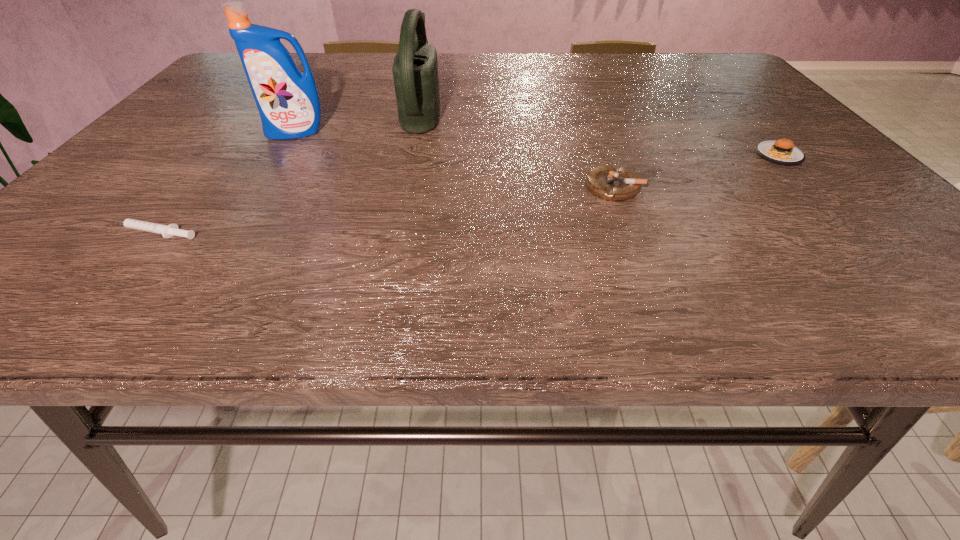
Locate an element on the screen. empty space between the food and the detergent is located at coordinates (538, 144).

At what (x,y) coordinates should I click in order to perform the action: click on unoccupied area between the nearest object and the food. Please return your answer as a coordinate pair (x, y). This screenshot has height=540, width=960. Looking at the image, I should click on (465, 194).

Identify the location of vacant space that's between the food and the third object from left to right. (601, 132).

Locate an element on the screen. This screenshot has height=540, width=960. unoccupied area between the second tallest object and the syringe is located at coordinates (286, 171).

What are the coordinates of `unoccupied position between the third object from left to right and the detergent` in the screenshot? It's located at (359, 121).

Locate an element on the screen. The image size is (960, 540). vacant area that lies between the third object from right to left and the shortest object is located at coordinates (286, 171).

The width and height of the screenshot is (960, 540). I want to click on empty space that is in between the rightmost object and the second tallest object, so click(601, 132).

I want to click on blank region between the syringe and the detergent, so (x=223, y=183).

The width and height of the screenshot is (960, 540). What are the coordinates of `vacant space that is in between the detergent and the shortest object` in the screenshot? It's located at (223, 183).

You are a GUI agent. You are given a task and a screenshot of the screen. Output one action in this format:
    pyautogui.click(x=<x>, y=<y>)
    Task: Click on the free point between the fourth farthest object and the detergent
    The width and height of the screenshot is (960, 540).
    Given the screenshot: What is the action you would take?
    pyautogui.click(x=455, y=160)